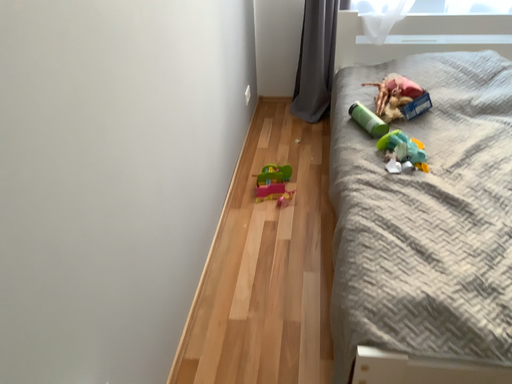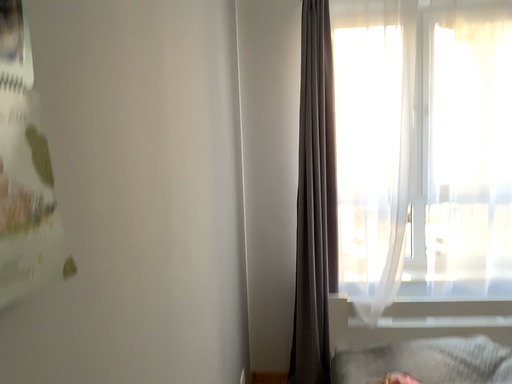
Question: Which way did the camera rotate in the video?

Choices:
 (A) rotated downward
 (B) rotated upward

Answer: (B)